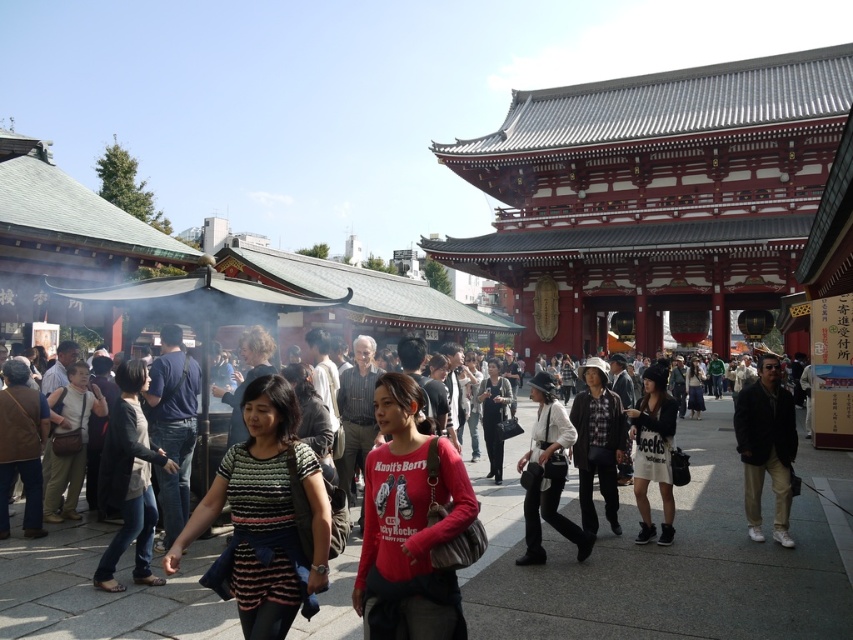
You are standing at the point labeled point (695, 372) and want to walk to the red gate in the background. Is the point labeled point (761, 404) between you and the red gate?

Yes, the point labeled point (761, 404) is between you and the red gate because it is in front of point (695, 372), which is your current position.

You are a photographer at the temple and want to capture both the matte red shirt at center and the black matte jacket at center in a single photo. Which of the two items should you focus on first to ensure both are in frame?

The matte red shirt at center is below the black matte jacket at center, so focusing on the black matte jacket at center first will allow you to adjust the camera angle downward to include the matte red shirt at center in the frame.

You are standing at the center of the scene and want to find the brown leather jacket at lower left. In which direction should you look to locate it?

The brown leather jacket at lower left is located at the lower left direction from your current position at the center of the scene.